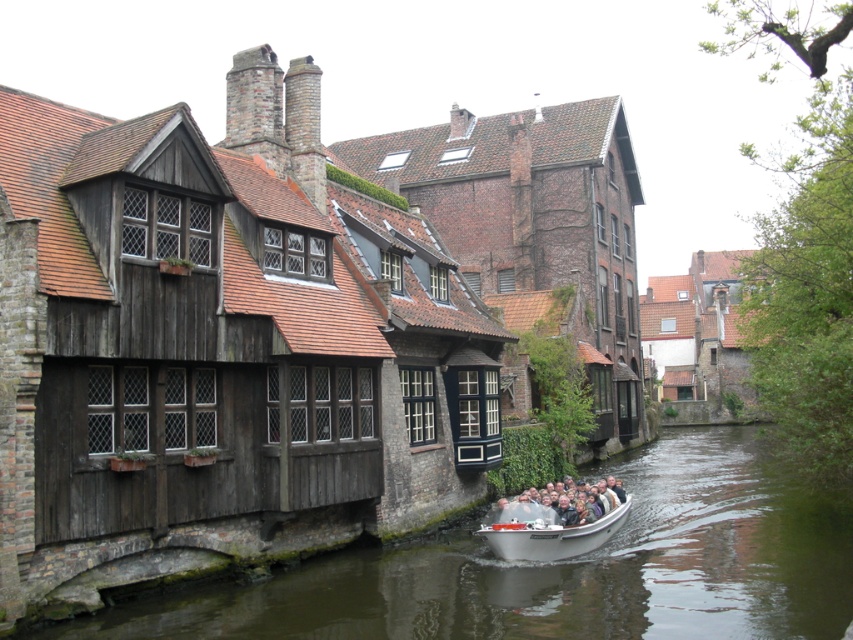
Describe the element at coordinates (564, 568) in the screenshot. The image size is (853, 640). I see `greenish water at center` at that location.

The width and height of the screenshot is (853, 640). I want to click on greenish water at center, so click(x=564, y=568).